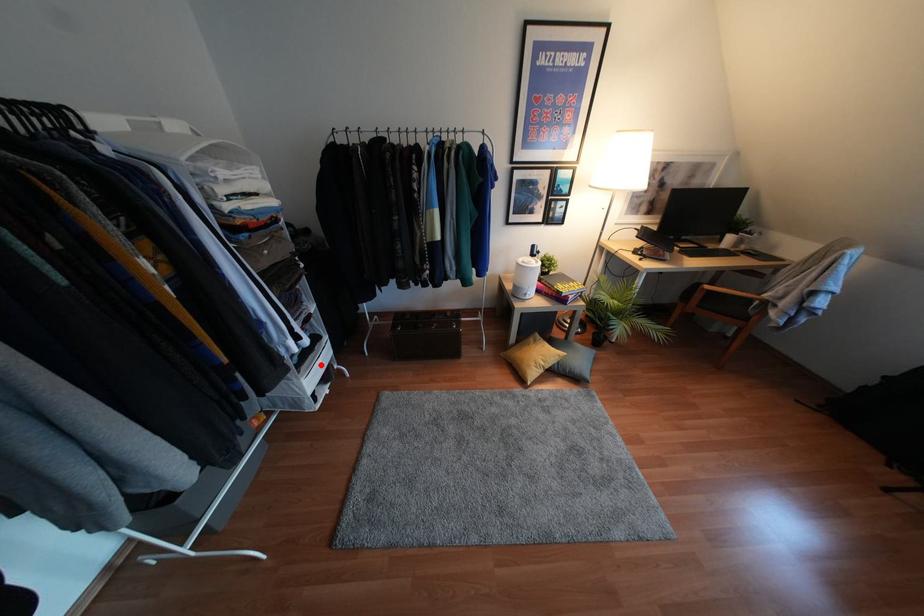
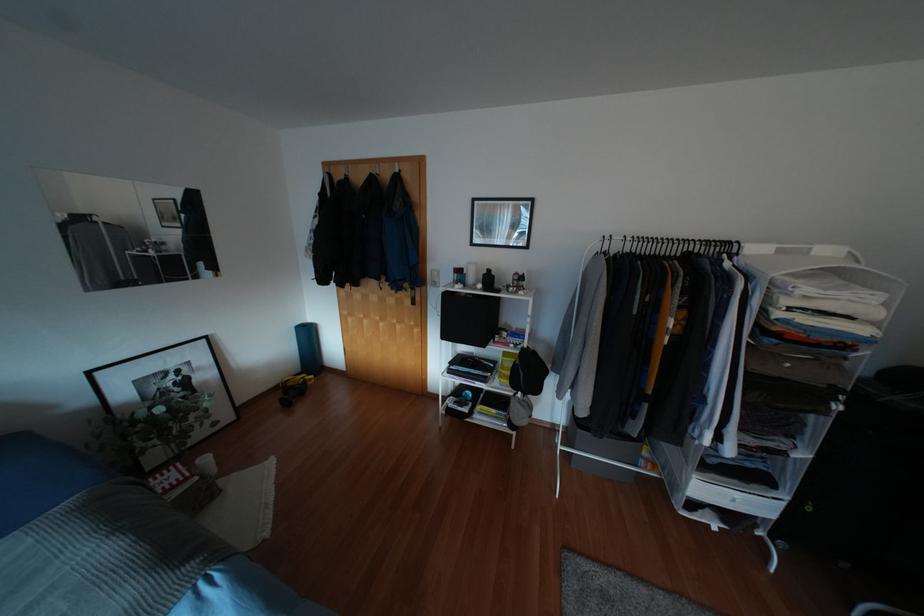
Question: I am providing you with two images of the same scene from different viewpoints. In image1, a red point is highlighted. Considering the same 3D point in image2, which of the following is correct?

Choices:
 (A) It is closer
 (B) It is farther

Answer: (B)